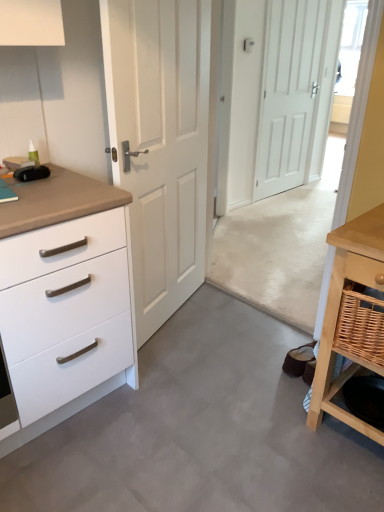
Identify the location of free point below white matte door at center, placed as the 2th door when sorted from right to left (from a real-world perspective). This screenshot has width=384, height=512. (178, 312).